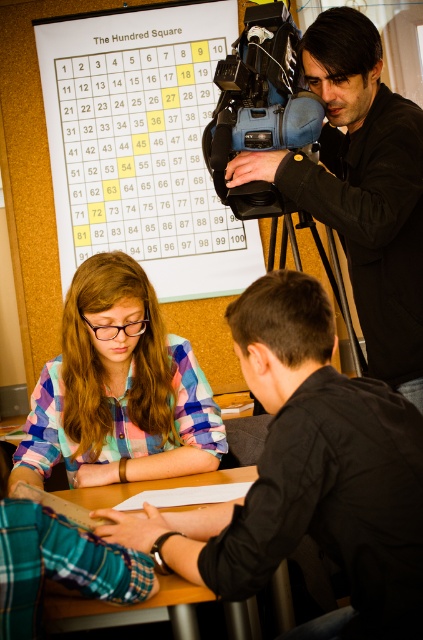
Question: Is black matte camera at upper center thinner than blue plastic video camera at upper right?

Choices:
 (A) no
 (B) yes

Answer: (A)

Question: Can you confirm if plaid shirt at center is positioned below blue plastic video camera at upper right?

Choices:
 (A) yes
 (B) no

Answer: (A)

Question: Which point is farther to the camera?

Choices:
 (A) white paper at upper center
 (B) wooden table at center
 (C) blue plastic video camera at upper right
 (D) black metal tripod at upper right

Answer: (A)

Question: Which point is farther to the camera?

Choices:
 (A) white paper at upper center
 (B) wooden table at center

Answer: (A)

Question: Considering the real-world distances, which object is closest to the black matte shirt at upper right?

Choices:
 (A) black matte camera at upper center
 (B) wooden table at center

Answer: (B)

Question: Is the position of black matte camera at upper center more distant than that of wooden table at center?

Choices:
 (A) yes
 (B) no

Answer: (A)